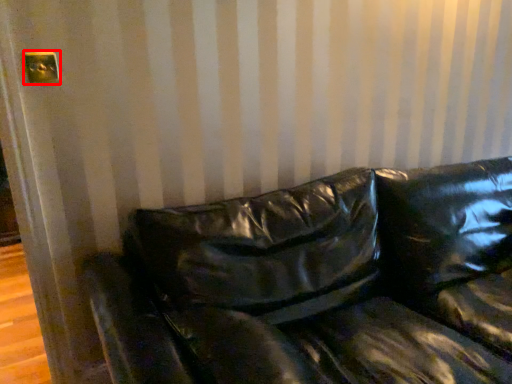
Question: From the image's perspective, what is the correct spatial positioning of electric outlet (annotated by the red box) in reference to studio couch?

Choices:
 (A) above
 (B) below

Answer: (A)